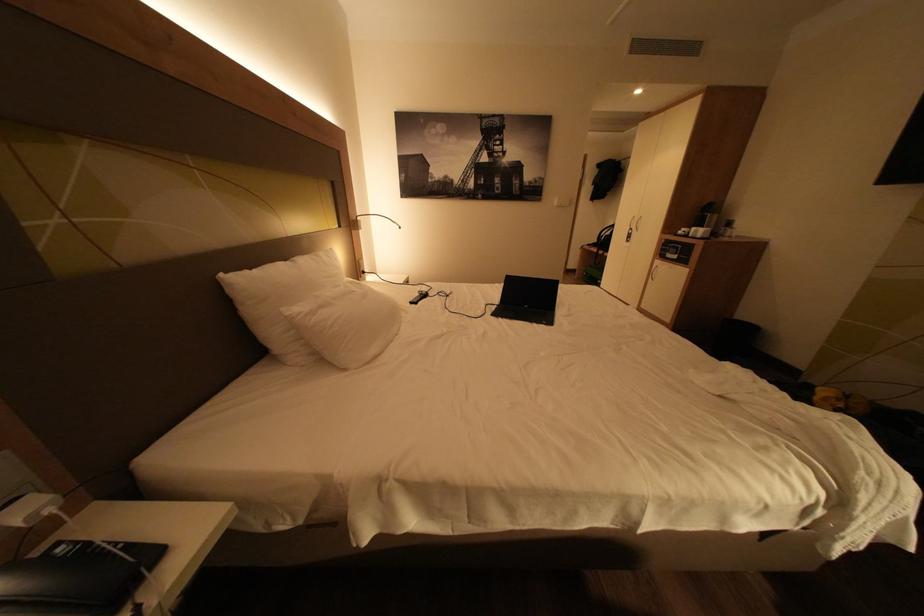
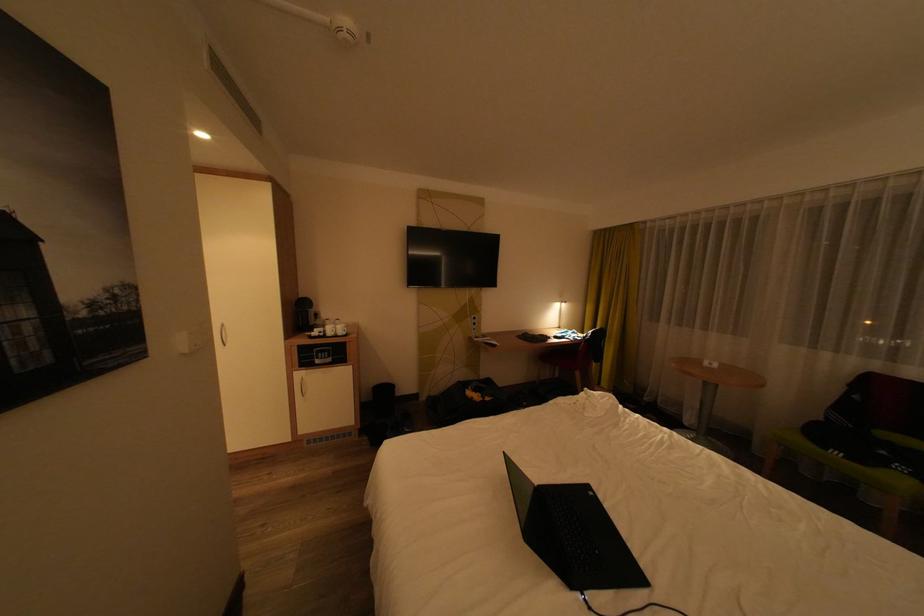
Locate, in the second image, the point that corresponds to the point at 695,232 in the first image.

(331, 333)